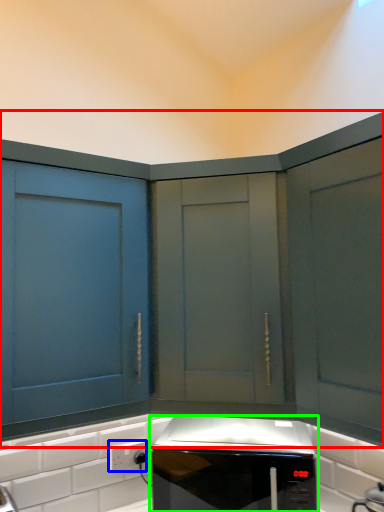
Question: Estimate the real-world distances between objects in this image. Which object is closer to cabinetry (highlighted by a red box), electric outlet (highlighted by a blue box) or home appliance (highlighted by a green box)?

Choices:
 (A) electric outlet
 (B) home appliance

Answer: (B)